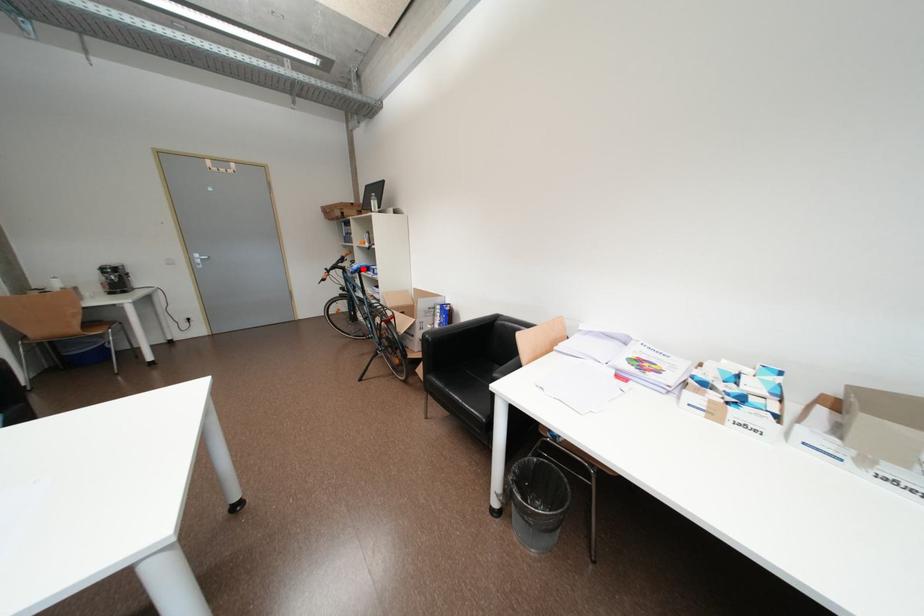
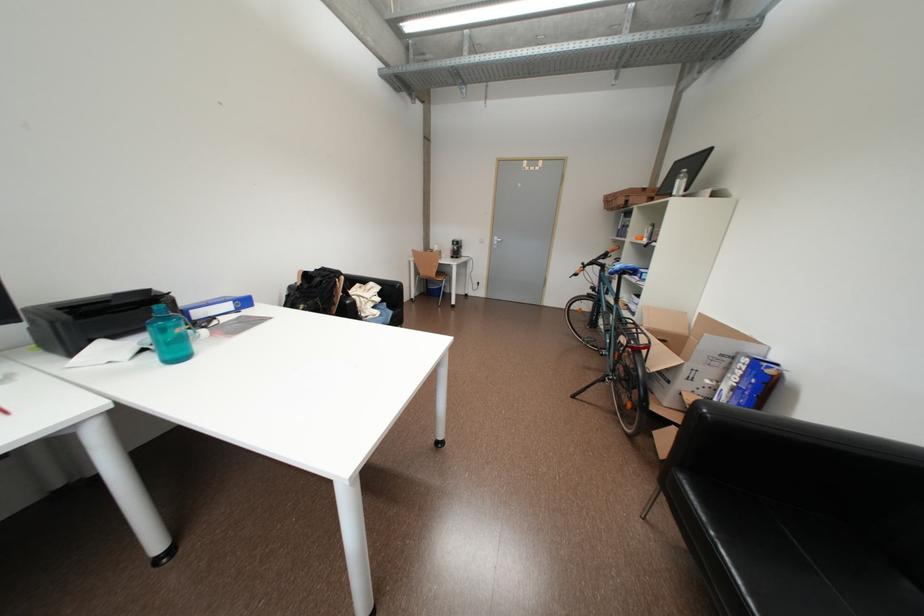
In the second image, find the point that corresponds to the highlighted location in the first image.

(626, 268)